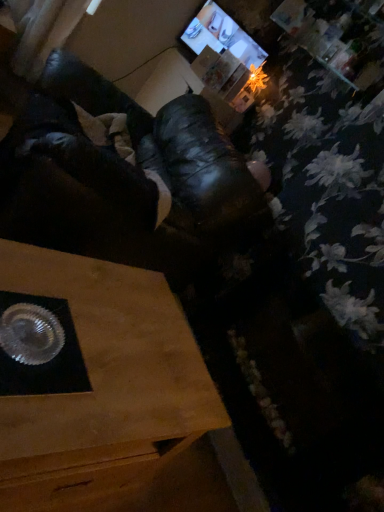
Question: Is matte black monitor at upper center wider or thinner than wooden table at lower left?

Choices:
 (A) wide
 (B) thin

Answer: (B)

Question: From their relative heights in the image, would you say matte black monitor at upper center is taller or shorter than wooden table at lower left?

Choices:
 (A) tall
 (B) short

Answer: (B)

Question: Estimate the real-world distances between objects in this image. Which object is farther from the shiny metallic tray at lower left?

Choices:
 (A) matte black monitor at upper center
 (B) wooden table at lower left

Answer: (A)

Question: Which object is the closest to the wooden table at lower left?

Choices:
 (A) shiny metallic tray at lower left
 (B) matte black monitor at upper center

Answer: (A)